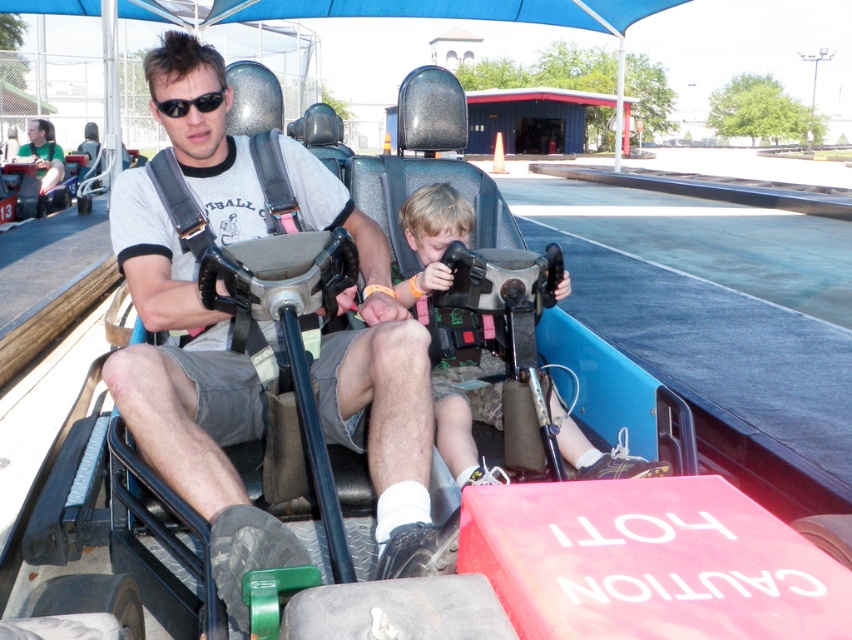
Consider the image. Does matte gray steering wheel at center appear on the left side of black matte sunglasses at upper center?

In fact, matte gray steering wheel at center is to the right of black matte sunglasses at upper center.

Image resolution: width=852 pixels, height=640 pixels. What do you see at coordinates (190, 394) in the screenshot?
I see `matte gray steering wheel at center` at bounding box center [190, 394].

I want to click on matte gray steering wheel at center, so click(x=190, y=394).

I want to click on matte gray steering wheel at center, so click(x=190, y=394).

Is point (298, 161) positioned behind point (442, 244)?

That is False.

What do you see at coordinates (190, 394) in the screenshot? The height and width of the screenshot is (640, 852). I see `matte gray steering wheel at center` at bounding box center [190, 394].

Does point (286, 554) lie in front of point (401, 236)?

Yes, point (286, 554) is closer to viewer.

In order to click on matte gray steering wheel at center in this screenshot , I will do `click(190, 394)`.

Between camouflage shorts at center and black matte sunglasses at upper center, which one has less height?

With less height is black matte sunglasses at upper center.

Can you confirm if camouflage shorts at center is taller than black matte sunglasses at upper center?

Correct, camouflage shorts at center is much taller as black matte sunglasses at upper center.

Is point (467, 419) farther from viewer compared to point (206, 108)?

Yes, point (467, 419) is behind point (206, 108).

This screenshot has width=852, height=640. I want to click on camouflage shorts at center, so click(430, 236).